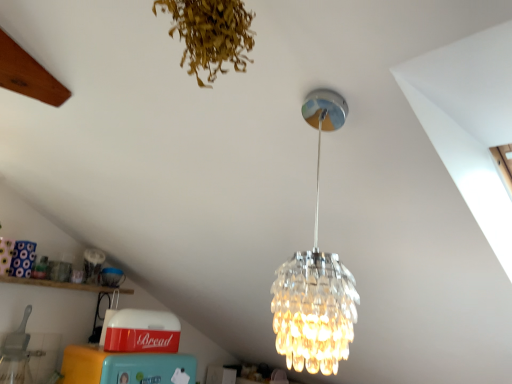
What is the approximate width of clear glass chandelier at center?

8.32 inches.

Identify the location of wooden shelf at lower left. The image size is (512, 384). (56, 284).

Where is `brown dried leaves at upper center`? brown dried leaves at upper center is located at coordinates (211, 34).

The height and width of the screenshot is (384, 512). In order to click on clear glass chandelier at center in this screenshot , I will do `click(315, 277)`.

What's the angular difference between wooden shelf at lower left and clear glass chandelier at center's facing directions?

There is a 89.8-degree angle between the facing directions of wooden shelf at lower left and clear glass chandelier at center.

Is wooden shelf at lower left in front of clear glass chandelier at center?

No, it is not.

Find the location of a particular element. The height and width of the screenshot is (384, 512). shelf lying behind the clear glass chandelier at center is located at coordinates (56, 284).

Where is `plant that appears above the clear glass chandelier at center (from a real-world perspective)`? The height and width of the screenshot is (384, 512). plant that appears above the clear glass chandelier at center (from a real-world perspective) is located at coordinates (211, 34).

Can you confirm if brown dried leaves at upper center is positioned to the right of clear glass chandelier at center?

No, brown dried leaves at upper center is not to the right of clear glass chandelier at center.

Is clear glass chandelier at center completely or partially inside brown dried leaves at upper center?

No.

Is brown dried leaves at upper center closer to the viewer compared to clear glass chandelier at center?

Yes, brown dried leaves at upper center is closer to the viewer.

From a real-world perspective, relative to wooden shelf at lower left, is brown dried leaves at upper center vertically above or below?

brown dried leaves at upper center is above wooden shelf at lower left.

Is brown dried leaves at upper center in front of or behind wooden shelf at lower left in the image?

brown dried leaves at upper center is positioned closer to the viewer than wooden shelf at lower left.

Which is behind, point (183, 9) or point (28, 284)?

Point (28, 284)

Is brown dried leaves at upper center next to wooden shelf at lower left?

brown dried leaves at upper center is not next to wooden shelf at lower left, and they're not touching.

How far apart are wooden shelf at lower left and brown dried leaves at upper center?

A distance of 6.76 feet exists between wooden shelf at lower left and brown dried leaves at upper center.

Can you confirm if wooden shelf at lower left is bigger than brown dried leaves at upper center?

Yes, wooden shelf at lower left is bigger than brown dried leaves at upper center.

Considering the relative sizes of wooden shelf at lower left and brown dried leaves at upper center in the image provided, is wooden shelf at lower left taller than brown dried leaves at upper center?

Incorrect, the height of wooden shelf at lower left is not larger of that of brown dried leaves at upper center.

How far apart are clear glass chandelier at center and brown dried leaves at upper center?

They are 19.21 inches apart.

Considering the relative positions of clear glass chandelier at center and brown dried leaves at upper center in the image provided, is clear glass chandelier at center to the left of brown dried leaves at upper center from the viewer's perspective?

No, clear glass chandelier at center is not to the left of brown dried leaves at upper center.

Is clear glass chandelier at center directly adjacent to brown dried leaves at upper center?

clear glass chandelier at center is not next to brown dried leaves at upper center, and they're not touching.

Considering the sizes of objects clear glass chandelier at center and brown dried leaves at upper center in the image provided, who is wider, clear glass chandelier at center or brown dried leaves at upper center?

Wider between the two is clear glass chandelier at center.

Is there a large distance between clear glass chandelier at center and wooden shelf at lower left?

Absolutely, clear glass chandelier at center is distant from wooden shelf at lower left.

Considering the sizes of objects clear glass chandelier at center and wooden shelf at lower left in the image provided, who is taller, clear glass chandelier at center or wooden shelf at lower left?

clear glass chandelier at center.

Does clear glass chandelier at center have a smaller size compared to wooden shelf at lower left?

No.

Is clear glass chandelier at center facing towards wooden shelf at lower left?

No.

The width and height of the screenshot is (512, 384). I want to click on lamp in front of the wooden shelf at lower left, so click(315, 277).

Locate an element on the screen. The width and height of the screenshot is (512, 384). lamp lying on the right of brown dried leaves at upper center is located at coordinates (315, 277).

When comparing their distances from clear glass chandelier at center, does wooden shelf at lower left or brown dried leaves at upper center seem further?

wooden shelf at lower left is positioned further to the anchor clear glass chandelier at center.

Looking at the image, which one is located further to brown dried leaves at upper center, wooden shelf at lower left or clear glass chandelier at center?

The object further to brown dried leaves at upper center is wooden shelf at lower left.

Based on their spatial positions, is brown dried leaves at upper center or clear glass chandelier at center closer to wooden shelf at lower left?

The object closer to wooden shelf at lower left is clear glass chandelier at center.

From the image, which object appears to be nearer to wooden shelf at lower left, clear glass chandelier at center or brown dried leaves at upper center?

Among the two, clear glass chandelier at center is located nearer to wooden shelf at lower left.

Looking at the image, which one is located closer to brown dried leaves at upper center, clear glass chandelier at center or wooden shelf at lower left?

clear glass chandelier at center.

When comparing their distances from clear glass chandelier at center, does brown dried leaves at upper center or wooden shelf at lower left seem further?

Based on the image, wooden shelf at lower left appears to be further to clear glass chandelier at center.

Locate an element on the screen. The height and width of the screenshot is (384, 512). lamp between brown dried leaves at upper center and wooden shelf at lower left from front to back is located at coordinates (315, 277).